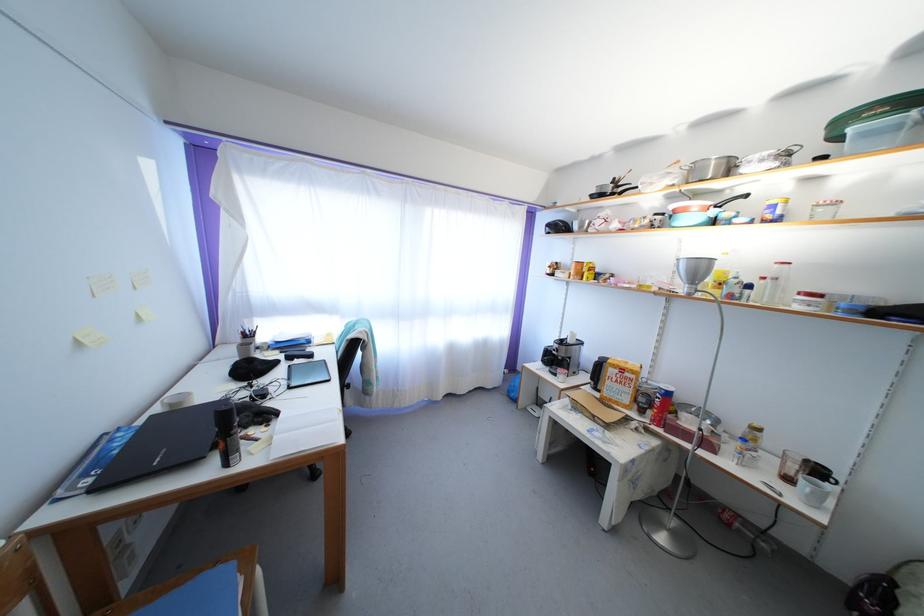
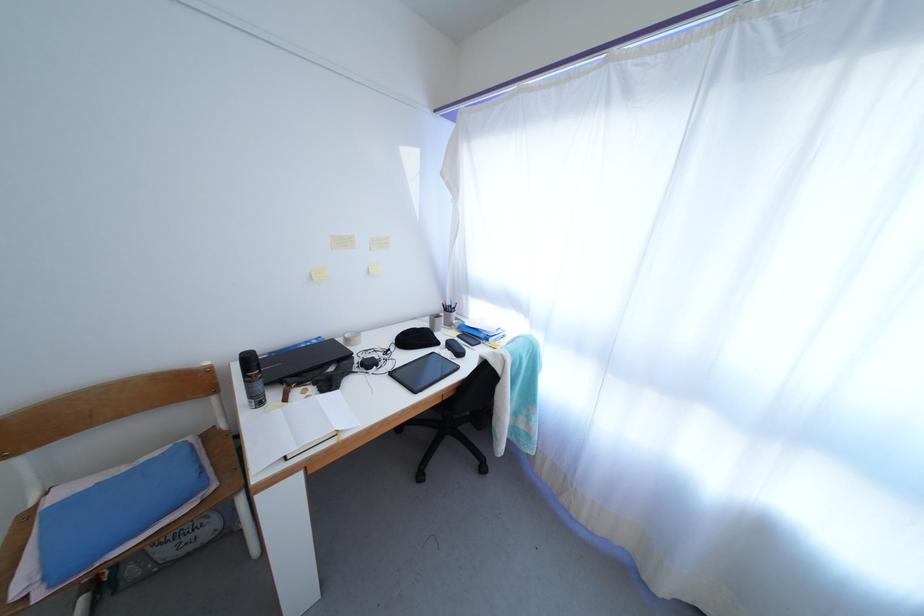
In the second image, find the point that corresponds to the point at 295,363 in the first image.

(456, 351)